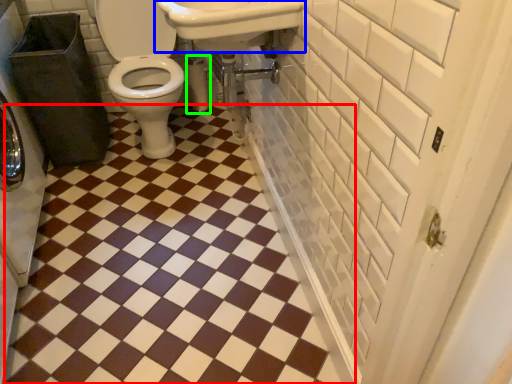
Question: Estimate the real-world distances between objects in this image. Which object is closer to ceramic tile (highlighted by a red box), sink (highlighted by a blue box) or toilet paper (highlighted by a green box)?

Choices:
 (A) sink
 (B) toilet paper

Answer: (A)